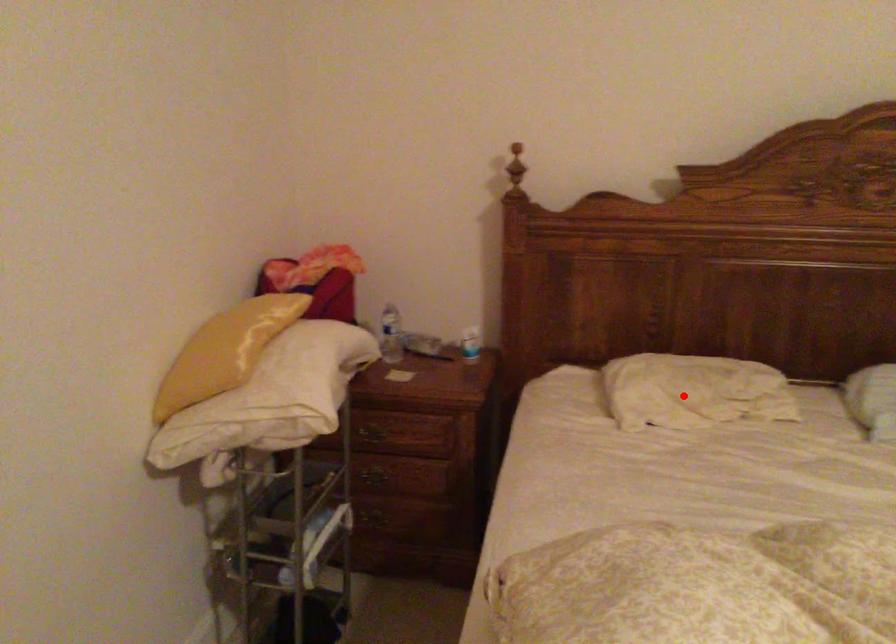
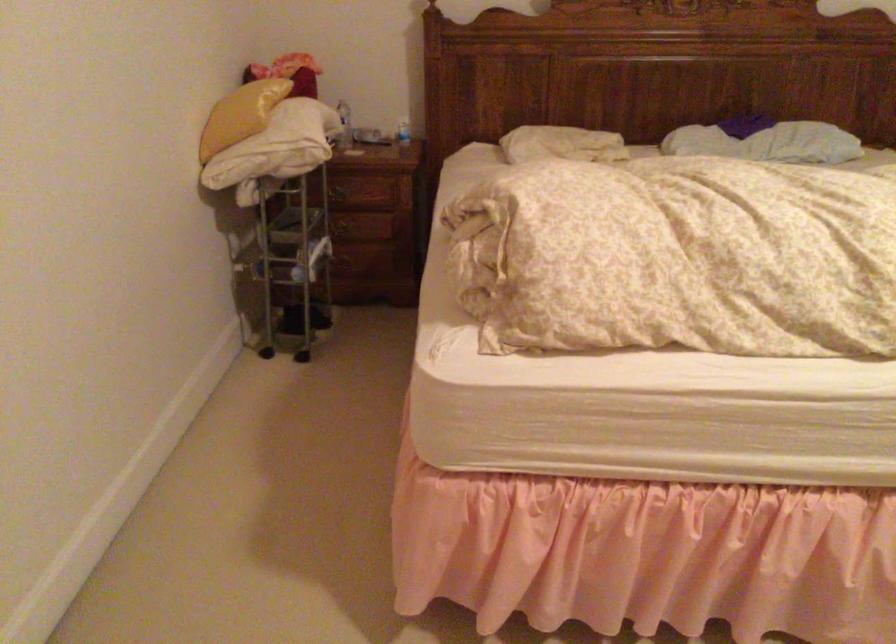
Question: A red point is marked in image1. In image2, is the corresponding 3D point closer to the camera or farther? Reply with the corresponding letter.

Choices:
 (A) The corresponding 3D point is closer.
 (B) The corresponding 3D point is farther.

Answer: (B)